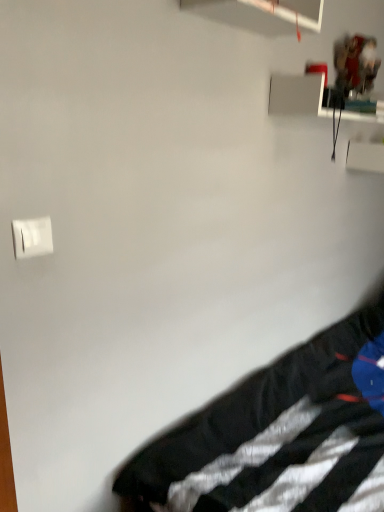
Question: From the image's perspective, does black fabric at lower right appear higher than white plastic light switch at upper left?

Choices:
 (A) yes
 (B) no

Answer: (B)

Question: Would you consider black fabric at lower right to be distant from white plastic light switch at upper left?

Choices:
 (A) no
 (B) yes

Answer: (A)

Question: Does black fabric at lower right have a greater height compared to white plastic light switch at upper left?

Choices:
 (A) yes
 (B) no

Answer: (A)

Question: Is black fabric at lower right aimed at white plastic light switch at upper left?

Choices:
 (A) yes
 (B) no

Answer: (B)

Question: From a real-world perspective, is black fabric at lower right on top of white plastic light switch at upper left?

Choices:
 (A) yes
 (B) no

Answer: (B)

Question: Considering the relative sizes of black fabric at lower right and white plastic light switch at upper left in the image provided, is black fabric at lower right thinner than white plastic light switch at upper left?

Choices:
 (A) yes
 (B) no

Answer: (B)

Question: From the image's perspective, would you say white plastic light switch at upper left is positioned over black fabric at lower right?

Choices:
 (A) yes
 (B) no

Answer: (A)

Question: Is white plastic light switch at upper left far from black fabric at lower right?

Choices:
 (A) no
 (B) yes

Answer: (A)

Question: Considering the relative sizes of white plastic light switch at upper left and black fabric at lower right in the image provided, is white plastic light switch at upper left thinner than black fabric at lower right?

Choices:
 (A) yes
 (B) no

Answer: (A)

Question: Is white plastic light switch at upper left positioned before black fabric at lower right?

Choices:
 (A) no
 (B) yes

Answer: (A)

Question: From a real-world perspective, does white plastic light switch at upper left stand above black fabric at lower right?

Choices:
 (A) yes
 (B) no

Answer: (A)

Question: Does white plastic light switch at upper left have a smaller size compared to black fabric at lower right?

Choices:
 (A) no
 (B) yes

Answer: (B)

Question: From a real-world perspective, relative to white plastic light switch at upper left, is black fabric at lower right vertically above or below?

Choices:
 (A) above
 (B) below

Answer: (B)